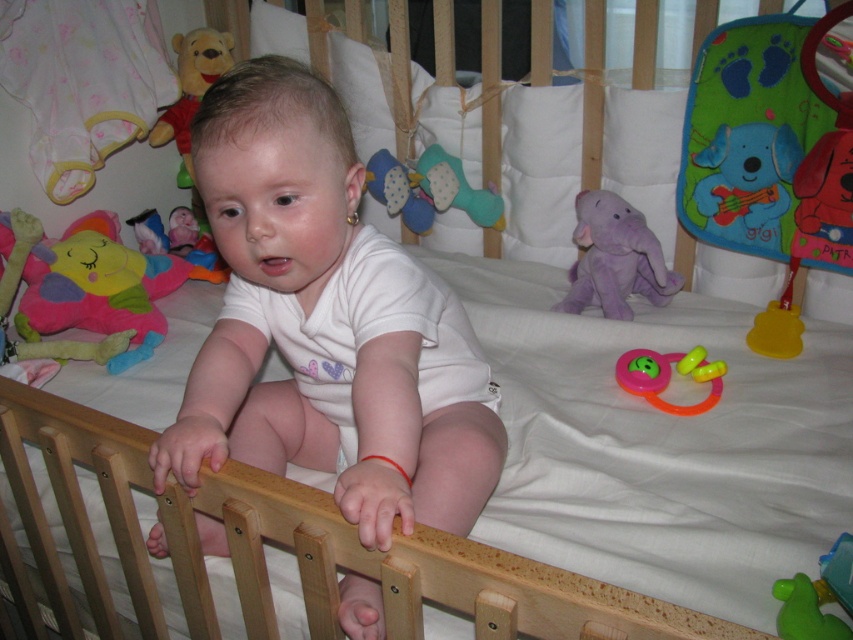
Question: Is green rubber duck at lower right to the left of rubber teething ring at center from the viewer's perspective?

Choices:
 (A) yes
 (B) no

Answer: (B)

Question: Can you confirm if purple plush elephant at upper center is positioned above red plush bear at upper left?

Choices:
 (A) yes
 (B) no

Answer: (B)

Question: Among these objects, which one is farthest from the camera?

Choices:
 (A) purple plush elephant at upper center
 (B) green rubber duck at lower right
 (C) green plush toy at upper right

Answer: (A)

Question: Among these objects, which one is nearest to the camera?

Choices:
 (A) red plush bear at upper left
 (B) white smooth baby at center

Answer: (B)

Question: Among these objects, which one is nearest to the camera?

Choices:
 (A) blue plush teething toy at center
 (B) white smooth baby at center
 (C) rubber teething ring at center

Answer: (B)

Question: Is white smooth baby at center smaller than blue plush teething toy at center?

Choices:
 (A) no
 (B) yes

Answer: (A)